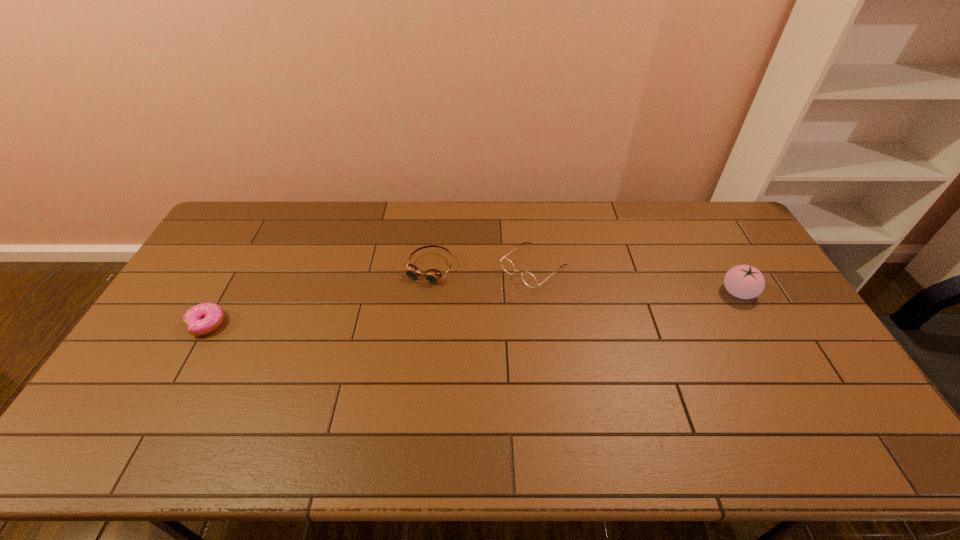
This screenshot has width=960, height=540. I want to click on free space located 0.260m on the front-facing side of the second tallest object, so click(452, 332).

This screenshot has width=960, height=540. I want to click on vacant space located on the front-facing side of the second tallest object, so click(x=469, y=318).

Where is `free space located 0.290m through the lenses of the second object from left to right`? Image resolution: width=960 pixels, height=540 pixels. free space located 0.290m through the lenses of the second object from left to right is located at coordinates tap(381, 356).

This screenshot has width=960, height=540. Identify the location of vacant region located through the lenses of the second object from left to right. (375, 365).

The width and height of the screenshot is (960, 540). What are the coordinates of `vacant space located through the lenses of the second object from left to right` in the screenshot? It's located at (372, 371).

At what (x,y) coordinates should I click in order to perform the action: click on object at the left edge. Please return your answer as a coordinate pair (x, y). The image size is (960, 540). Looking at the image, I should click on (204, 318).

This screenshot has width=960, height=540. Find the location of `object that is positioned at the right edge`. object that is positioned at the right edge is located at coordinates (743, 281).

Image resolution: width=960 pixels, height=540 pixels. I want to click on free space at the far edge of the desktop, so click(x=574, y=240).

Locate an element on the screen. vacant space at the left edge of the desktop is located at coordinates (211, 253).

Locate an element on the screen. blank area at the right edge is located at coordinates (841, 381).